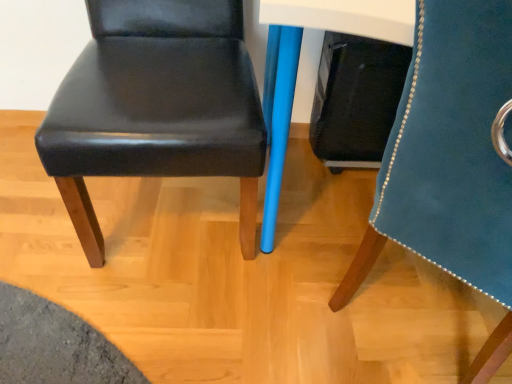
You are a GUI agent. You are given a task and a screenshot of the screen. Output one action in this format:
    pyautogui.click(x=<x>, y=<y>)
    Task: Click on the black leather chair at center, placed as the 2th chair when sorted from right to left
    The width and height of the screenshot is (512, 384).
    Given the screenshot: What is the action you would take?
    pyautogui.click(x=157, y=106)

Describe the element at coordinates (157, 106) in the screenshot. I see `black leather chair at center, placed as the 2th chair when sorted from right to left` at that location.

Image resolution: width=512 pixels, height=384 pixels. What do you see at coordinates (450, 162) in the screenshot?
I see `velvet blue chair at right, the first chair viewed from the right` at bounding box center [450, 162].

In order to face velvet blue chair at right, the second chair when ordered from left to right, should I rotate leftwards or rightwards?

It's best to rotate right around 28.875 degrees.

What are the coordinates of `velvet blue chair at right, the first chair viewed from the right` in the screenshot? It's located at (450, 162).

The width and height of the screenshot is (512, 384). What are the coordinates of `black leather chair at center, the 1th chair when ordered from left to right` in the screenshot? It's located at (157, 106).

Considering the relative positions of black leather chair at center, placed as the 2th chair when sorted from right to left, and velvet blue chair at right, the first chair viewed from the right, in the image provided, is black leather chair at center, placed as the 2th chair when sorted from right to left, to the left of velvet blue chair at right, the first chair viewed from the right, from the viewer's perspective?

Indeed, black leather chair at center, placed as the 2th chair when sorted from right to left, is positioned on the left side of velvet blue chair at right, the first chair viewed from the right.

Is black leather chair at center, placed as the 2th chair when sorted from right to left, further to camera compared to velvet blue chair at right, the first chair viewed from the right?

Yes.

Which is less distant, (60, 173) or (463, 2)?

Point (60, 173).

From the image's perspective, is black leather chair at center, placed as the 2th chair when sorted from right to left, located beneath velvet blue chair at right, the first chair viewed from the right?

Incorrect, from the image's perspective, black leather chair at center, placed as the 2th chair when sorted from right to left, is higher than velvet blue chair at right, the first chair viewed from the right.

From a real-world perspective, who is located lower, black leather chair at center, the 1th chair when ordered from left to right, or velvet blue chair at right, the second chair when ordered from left to right?

black leather chair at center, the 1th chair when ordered from left to right.

Between black leather chair at center, the 1th chair when ordered from left to right, and velvet blue chair at right, the second chair when ordered from left to right, which one has smaller width?

With smaller width is black leather chair at center, the 1th chair when ordered from left to right.

Is black leather chair at center, the 1th chair when ordered from left to right, taller than velvet blue chair at right, the second chair when ordered from left to right?

No.

In the scene shown: Considering the sizes of objects black leather chair at center, the 1th chair when ordered from left to right, and velvet blue chair at right, the first chair viewed from the right, in the image provided, who is smaller, black leather chair at center, the 1th chair when ordered from left to right, or velvet blue chair at right, the first chair viewed from the right,?

Smaller between the two is black leather chair at center, the 1th chair when ordered from left to right.

Is velvet blue chair at right, the first chair viewed from the right, located within black leather chair at center, placed as the 2th chair when sorted from right to left?

No.

Is black leather chair at center, placed as the 2th chair when sorted from right to left, far away from velvet blue chair at right, the second chair when ordered from left to right?

No, black leather chair at center, placed as the 2th chair when sorted from right to left, is in close proximity to velvet blue chair at right, the second chair when ordered from left to right.

Is black leather chair at center, placed as the 2th chair when sorted from right to left, facing away from velvet blue chair at right, the first chair viewed from the right?

That's not correct — black leather chair at center, placed as the 2th chair when sorted from right to left, is not looking away from velvet blue chair at right, the first chair viewed from the right.

How different are the orientations of black leather chair at center, placed as the 2th chair when sorted from right to left, and velvet blue chair at right, the first chair viewed from the right, in degrees?

The angle between the facing direction of black leather chair at center, placed as the 2th chair when sorted from right to left, and the facing direction of velvet blue chair at right, the first chair viewed from the right, is 132 degrees.

Measure the distance between black leather chair at center, placed as the 2th chair when sorted from right to left, and velvet blue chair at right, the second chair when ordered from left to right.

black leather chair at center, placed as the 2th chair when sorted from right to left, is 20.12 inches from velvet blue chair at right, the second chair when ordered from left to right.

The width and height of the screenshot is (512, 384). What are the coordinates of `chair in front of the black leather chair at center, the 1th chair when ordered from left to right` in the screenshot? It's located at (450, 162).

Based on their positions, is velvet blue chair at right, the second chair when ordered from left to right, located to the left or right of black leather chair at center, the 1th chair when ordered from left to right?

From the image, it's evident that velvet blue chair at right, the second chair when ordered from left to right, is to the right of black leather chair at center, the 1th chair when ordered from left to right.

Is the position of velvet blue chair at right, the first chair viewed from the right, less distant than that of black leather chair at center, placed as the 2th chair when sorted from right to left?

Yes, the depth of velvet blue chair at right, the first chair viewed from the right, is less than that of black leather chair at center, placed as the 2th chair when sorted from right to left.

Which is farther, (415, 84) or (158, 127)?

The point (158, 127) is behind.

From the image's perspective, is velvet blue chair at right, the first chair viewed from the right, above black leather chair at center, the 1th chair when ordered from left to right?

No.

From a real-world perspective, which is physically above, velvet blue chair at right, the second chair when ordered from left to right, or black leather chair at center, placed as the 2th chair when sorted from right to left?

velvet blue chair at right, the second chair when ordered from left to right.

Considering the relative sizes of velvet blue chair at right, the second chair when ordered from left to right, and black leather chair at center, placed as the 2th chair when sorted from right to left, in the image provided, is velvet blue chair at right, the second chair when ordered from left to right, thinner than black leather chair at center, placed as the 2th chair when sorted from right to left,?

In fact, velvet blue chair at right, the second chair when ordered from left to right, might be wider than black leather chair at center, placed as the 2th chair when sorted from right to left.

Considering the relative sizes of velvet blue chair at right, the first chair viewed from the right, and black leather chair at center, placed as the 2th chair when sorted from right to left, in the image provided, is velvet blue chair at right, the first chair viewed from the right, taller than black leather chair at center, placed as the 2th chair when sorted from right to left,?

Correct, velvet blue chair at right, the first chair viewed from the right, is much taller as black leather chair at center, placed as the 2th chair when sorted from right to left.

Can you confirm if velvet blue chair at right, the second chair when ordered from left to right, is smaller than black leather chair at center, the 1th chair when ordered from left to right?

No.

Is velvet blue chair at right, the second chair when ordered from left to right, situated inside black leather chair at center, placed as the 2th chair when sorted from right to left, or outside?

velvet blue chair at right, the second chair when ordered from left to right, exists outside the volume of black leather chair at center, placed as the 2th chair when sorted from right to left.

Is velvet blue chair at right, the second chair when ordered from left to right, not near black leather chair at center, placed as the 2th chair when sorted from right to left?

No, velvet blue chair at right, the second chair when ordered from left to right, is not far away from black leather chair at center, placed as the 2th chair when sorted from right to left.

Is velvet blue chair at right, the second chair when ordered from left to right, facing towards black leather chair at center, the 1th chair when ordered from left to right?

No.

From the picture: How many degrees apart are the facing directions of velvet blue chair at right, the first chair viewed from the right, and black leather chair at center, the 1th chair when ordered from left to right?

The angle between the facing direction of velvet blue chair at right, the first chair viewed from the right, and the facing direction of black leather chair at center, the 1th chair when ordered from left to right, is 132 degrees.

Find the location of a particular element. Image resolution: width=512 pixels, height=384 pixels. chair on the right of black leather chair at center, the 1th chair when ordered from left to right is located at coordinates (450, 162).

What are the coordinates of `chair on the right of black leather chair at center, the 1th chair when ordered from left to right` in the screenshot? It's located at (450, 162).

Where is `chair lying on the left of velvet blue chair at right, the first chair viewed from the right`? The image size is (512, 384). chair lying on the left of velvet blue chair at right, the first chair viewed from the right is located at coordinates (157, 106).